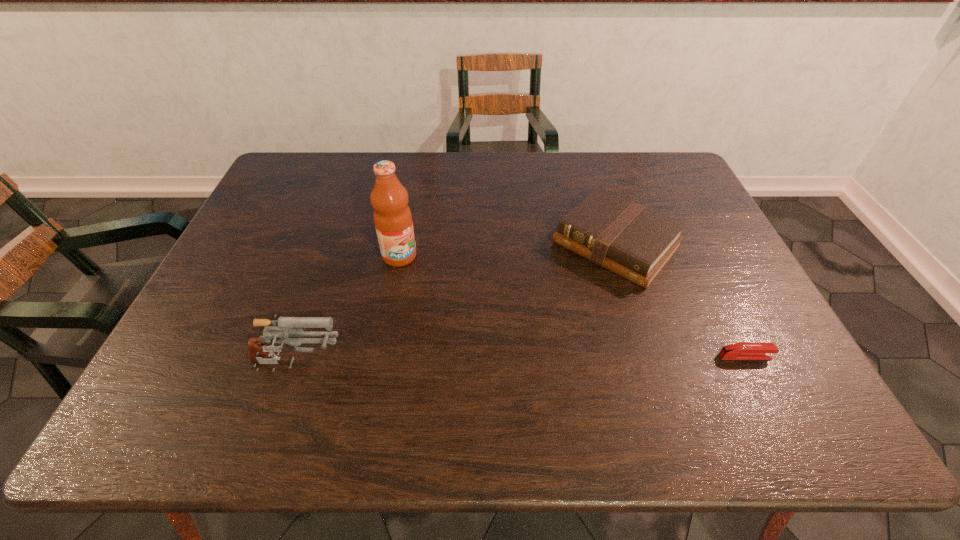
You are a GUI agent. You are given a task and a screenshot of the screen. Output one action in this format:
    pyautogui.click(x=<x>, y=<y>)
    Task: Click on the vacant area between the third object from right to left and the Bible
    
    Given the screenshot: What is the action you would take?
    pyautogui.click(x=508, y=250)

In order to click on unoccupied position between the second tallest object and the third object from right to left in this screenshot , I will do `click(348, 312)`.

Where is `vacant region between the second shortest object and the leftmost object`? This screenshot has width=960, height=540. vacant region between the second shortest object and the leftmost object is located at coordinates (456, 306).

Locate an element on the screen. vacant region between the Bible and the shortest object is located at coordinates (681, 300).

The image size is (960, 540). I want to click on object that is the third closest one to the stapler, so click(283, 328).

Identify which object is the third nearest to the shortest object. Please provide its 2D coordinates. Your answer should be formatted as a tuple, i.e. [(x, y)], where the tuple contains the x and y coordinates of a point satisfying the conditions above.

[(283, 328)]

The height and width of the screenshot is (540, 960). Identify the location of free spot that satisfies the following two spatial constraints: 1. on the back side of the second shortest object; 2. on the left side of the third object from right to left. (401, 244).